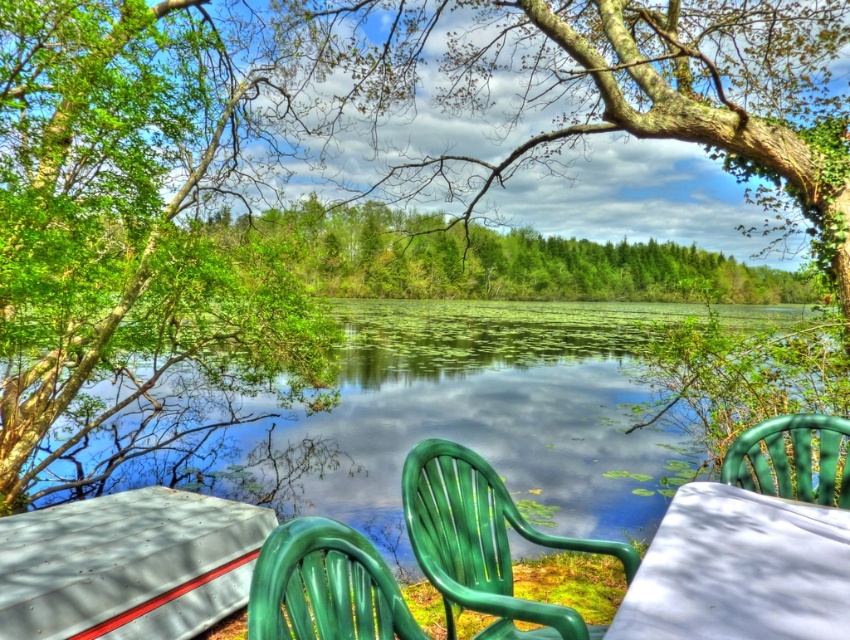
You are sitting at the white table between the two green plastic chairs. Which chair is closer to the lake, the green plastic chair at lower center or the green plastic chair at right?

The green plastic chair at lower center is closer to the lake because it is positioned to the left of the green plastic chair at right, and since both chairs are angled towards the lake, the one on the left would be nearer to the water.

You are a painter standing at the edge of the lake and want to set up your easel between the two green plastic chairs. The easel requires a space of 8 feet to be placed. Based on the scene, do you think the space between the green plastic chair at lower center and the green plastic chair at right is sufficient for your easel?

The distance between the green plastic chair at lower center and the green plastic chair at right is 7.59 feet. Since the easel requires 8 feet of space, the available space is slightly insufficient. You may need to adjust the placement of the chairs or find another location with more room.